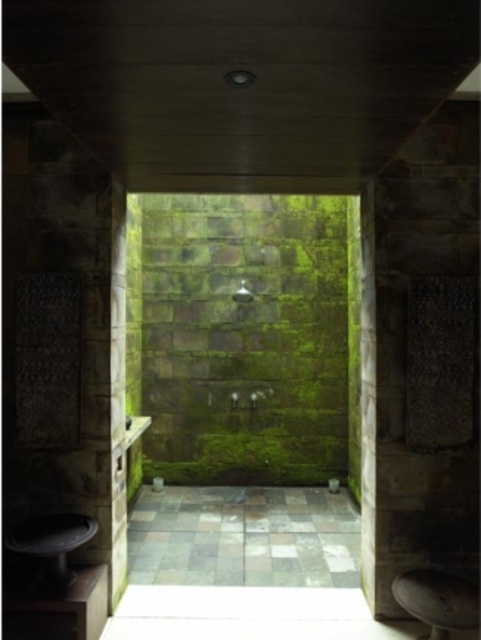
Question: Among these objects, which one is farthest from the camera?

Choices:
 (A) matte green stone shower at center
 (B) wooden stool at lower right

Answer: (A)

Question: Can you confirm if wooden stool at lower right is positioned to the right of matte green stone shower at center?

Choices:
 (A) no
 (B) yes

Answer: (B)

Question: Is wooden stool at lower right thinner than matte green stone shower at center?

Choices:
 (A) yes
 (B) no

Answer: (B)

Question: Which object is closer to the camera taking this photo?

Choices:
 (A) wooden stool at lower right
 (B) matte green stone shower at center

Answer: (A)

Question: Can you confirm if wooden stool at lower right is bigger than matte green stone shower at center?

Choices:
 (A) yes
 (B) no

Answer: (A)